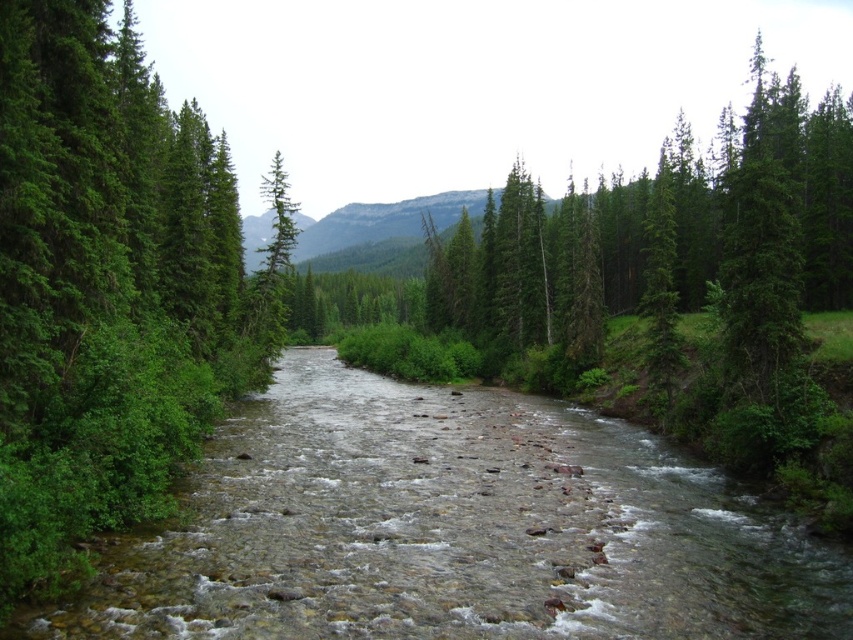
Question: Which point is closer to the camera?

Choices:
 (A) (265, 177)
 (B) (164, 451)
 (C) (310, 627)
 (D) (323, 218)

Answer: (C)

Question: Which point is closer to the camera taking this photo?

Choices:
 (A) (379, 474)
 (B) (409, 220)
 (C) (286, 195)

Answer: (A)

Question: Is clear stone stream at center in front of green matte evergreen tree at center?

Choices:
 (A) yes
 (B) no

Answer: (A)

Question: Which point is farther to the camera?

Choices:
 (A) (270, 426)
 (B) (294, 225)
 (C) (399, 273)
 (D) (6, 448)

Answer: (B)

Question: Can you confirm if clear stone stream at center is smaller than green matte evergreen tree at center?

Choices:
 (A) yes
 (B) no

Answer: (A)

Question: Can you confirm if green leafy tree at left is wider than green matte evergreen tree at center?

Choices:
 (A) no
 (B) yes

Answer: (A)